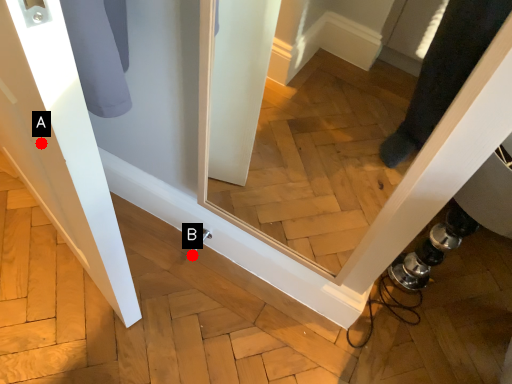
Question: Two points are circled on the image, labeled by A and B beside each circle. Which point appears closest to the camera in this image?

Choices:
 (A) A is closer
 (B) B is closer

Answer: (A)